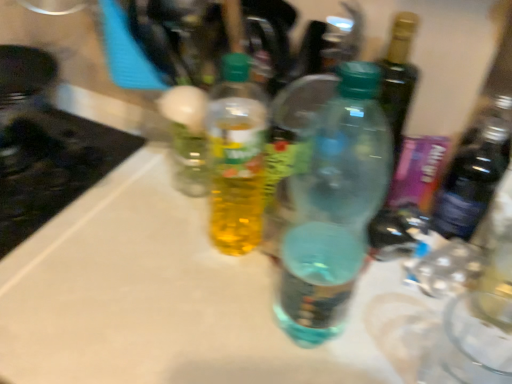
The image size is (512, 384). In order to click on empty space that is to the right of translucent plastic bottle at center, the second bottle when ordered from right to left in this screenshot , I will do `click(353, 292)`.